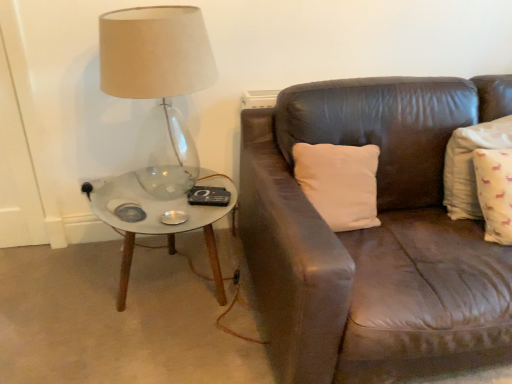
Question: Is white cotton pillow at right facing away from translucent glass lamp at left?

Choices:
 (A) no
 (B) yes

Answer: (A)

Question: Is white cotton pillow at right touching translucent glass lamp at left?

Choices:
 (A) yes
 (B) no

Answer: (B)

Question: From a real-world perspective, is white cotton pillow at right physically below translucent glass lamp at left?

Choices:
 (A) yes
 (B) no

Answer: (A)

Question: Would you say translucent glass lamp at left is part of white cotton pillow at right's contents?

Choices:
 (A) yes
 (B) no

Answer: (B)

Question: From the image's perspective, would you say white cotton pillow at right is positioned over translucent glass lamp at left?

Choices:
 (A) no
 (B) yes

Answer: (A)

Question: Can you confirm if white cotton pillow at right is positioned to the left of translucent glass lamp at left?

Choices:
 (A) no
 (B) yes

Answer: (A)

Question: Considering the relative sizes of white cotton pillow at right and white marble coffee table at left in the image provided, is white cotton pillow at right thinner than white marble coffee table at left?

Choices:
 (A) no
 (B) yes

Answer: (B)

Question: Is white cotton pillow at right with white marble coffee table at left?

Choices:
 (A) yes
 (B) no

Answer: (B)

Question: Is white marble coffee table at left surrounded by white cotton pillow at right?

Choices:
 (A) yes
 (B) no

Answer: (B)

Question: Is white cotton pillow at right positioned with its back to white marble coffee table at left?

Choices:
 (A) yes
 (B) no

Answer: (B)

Question: Is white cotton pillow at right behind white marble coffee table at left?

Choices:
 (A) yes
 (B) no

Answer: (B)

Question: Is white cotton pillow at right outside of white marble coffee table at left?

Choices:
 (A) no
 (B) yes

Answer: (B)

Question: From a real-world perspective, is translucent glass lamp at left positioned over white marble coffee table at left based on gravity?

Choices:
 (A) no
 (B) yes

Answer: (B)